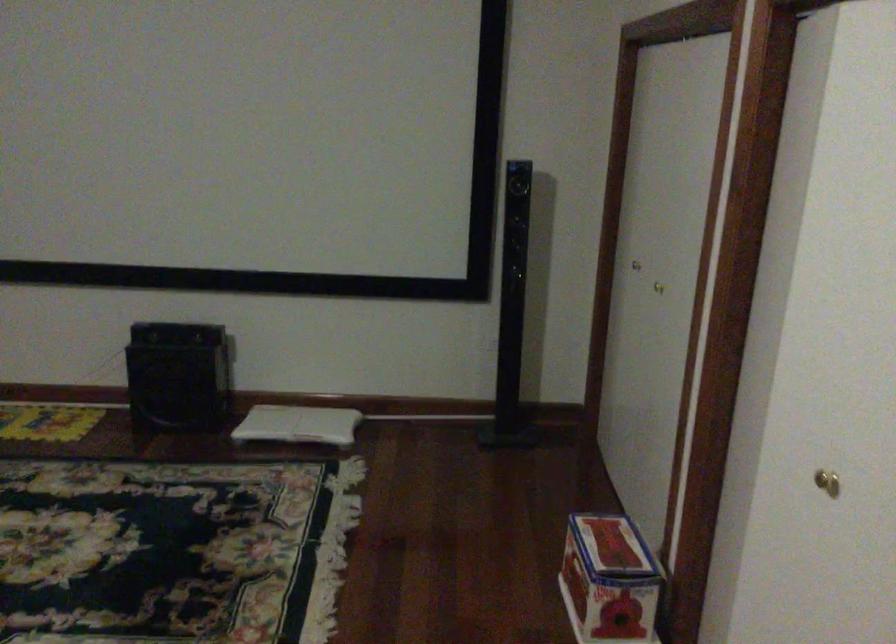
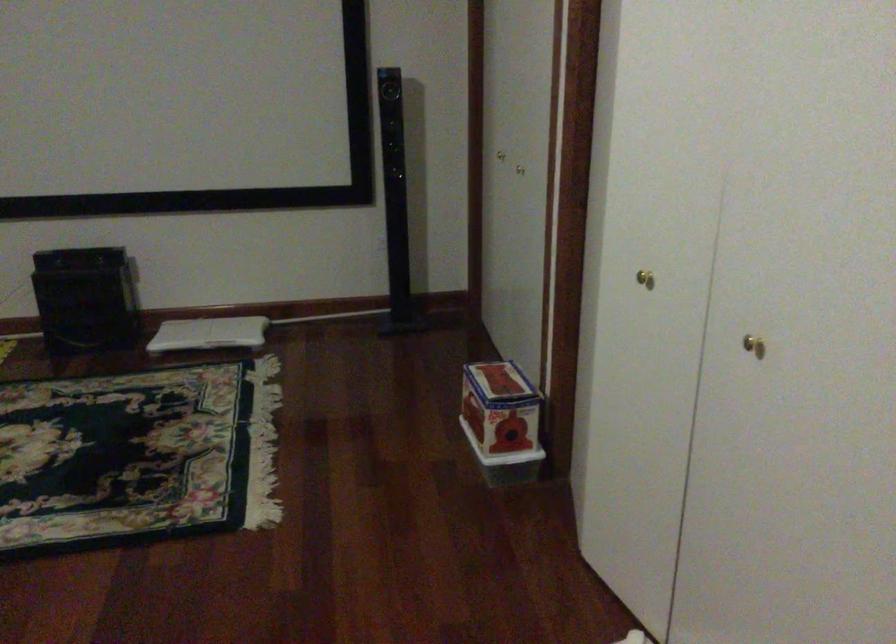
Question: The images are taken continuously from a first-person perspective. In which direction is your viewpoint rotating?

Choices:
 (A) Left
 (B) Right
 (C) Up
 (D) Down

Answer: (B)